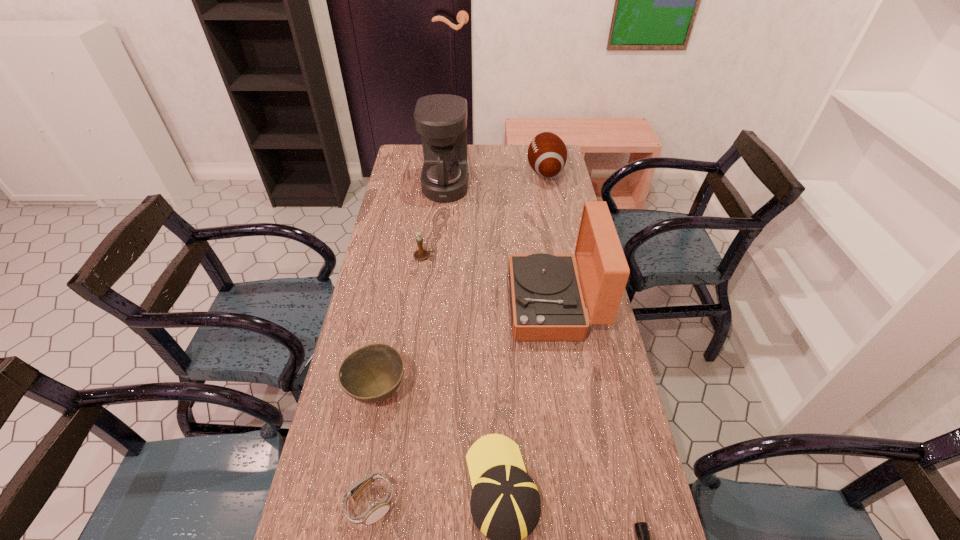
Image resolution: width=960 pixels, height=540 pixels. I want to click on vacant point located between the bowl and the fifth nearest object, so click(466, 348).

Identify which object is the second closest to the bowl. Please provide its 2D coordinates. Your answer should be formatted as a tuple, i.e. [(x, y)], where the tuple contains the x and y coordinates of a point satisfying the conditions above.

[(505, 504)]

In order to click on object that ranks as the seventh closest to the candle holder in this screenshot , I will do `click(641, 528)`.